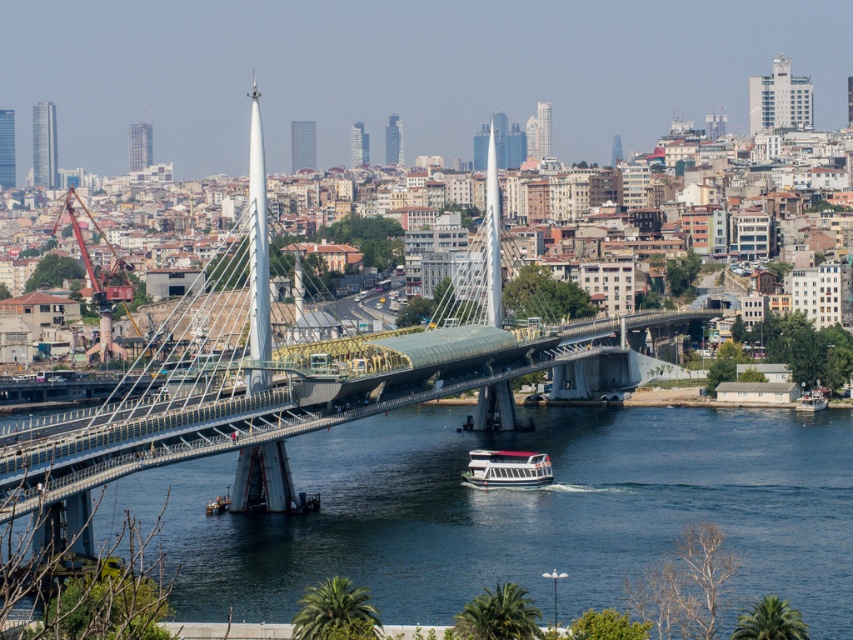
Is blue water at center above metallic glass bridge at center?

No, blue water at center is not above metallic glass bridge at center.

Is point (392, 419) farther from viewer compared to point (53, 435)?

That is True.

Measure the distance between point (816, 627) and camera.

Point (816, 627) is 180.12 meters from camera.

Where is `blue water at center`? This screenshot has width=853, height=640. blue water at center is located at coordinates (517, 513).

You are a GUI agent. You are given a task and a screenshot of the screen. Output one action in this format:
    pyautogui.click(x=<x>, y=<y>)
    Task: Click on the blue water at center
    Image resolution: width=853 pixels, height=640 pixels.
    Given the screenshot: What is the action you would take?
    tap(517, 513)

Is point (570, 605) behind point (503, 480)?

No.

Image resolution: width=853 pixels, height=640 pixels. What are the coordinates of `blue water at center` in the screenshot? It's located at (517, 513).

Between point (85, 461) and point (508, 468), which one is positioned in front?

Point (85, 461)

Can you confirm if metallic glass bridge at center is shorter than white glossy boat at lower center?

In fact, metallic glass bridge at center may be taller than white glossy boat at lower center.

Does point (289, 392) come closer to viewer compared to point (492, 474)?

Yes, it is.

At what (x,y) coordinates should I click in order to perform the action: click on metallic glass bridge at center. Please return your answer as a coordinate pair (x, y). This screenshot has width=853, height=640. Looking at the image, I should click on (254, 392).